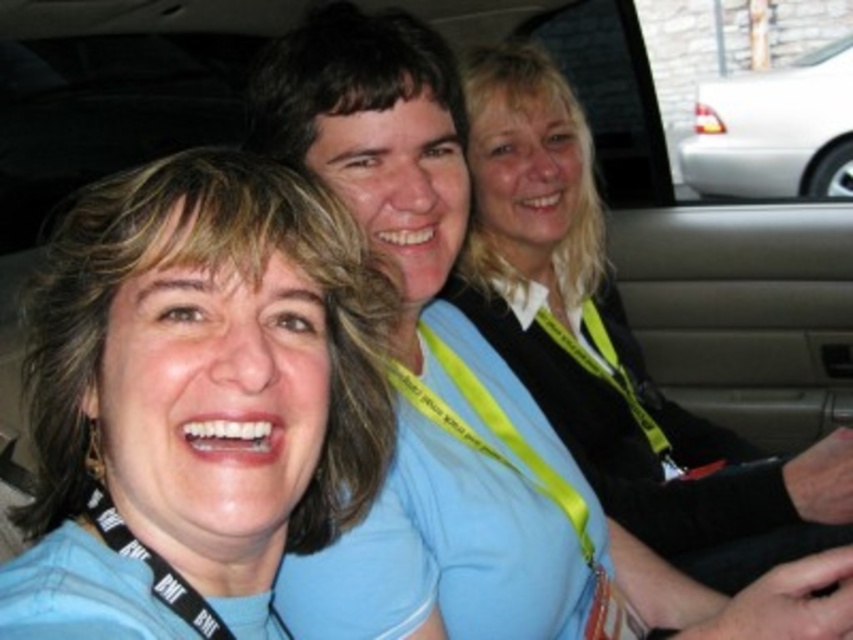
Does blue fabric face at center appear on the right side of black sweater at center?

Incorrect, blue fabric face at center is not on the right side of black sweater at center.

The image size is (853, 640). What do you see at coordinates (207, 342) in the screenshot?
I see `blue fabric face at center` at bounding box center [207, 342].

Is point (106, 428) behind point (592, 442)?

No.

Image resolution: width=853 pixels, height=640 pixels. I want to click on blue fabric face at center, so click(x=207, y=342).

Which is behind, point (70, 426) or point (712, 188)?

Point (712, 188)

Does blue fabric face at center have a smaller size compared to white glossy car at upper right?

Yes.

Who is more distant from viewer, (113, 243) or (831, 81)?

The point (831, 81) is behind.

Find the location of a particular element. blue fabric face at center is located at coordinates (207, 342).

Consider the image. Who is lower down, black sweater at center or white glossy car at upper right?

Positioned lower is black sweater at center.

From the picture: Does black sweater at center have a larger size compared to white glossy car at upper right?

No.

Find the location of `black sweater at center`. black sweater at center is located at coordinates (613, 346).